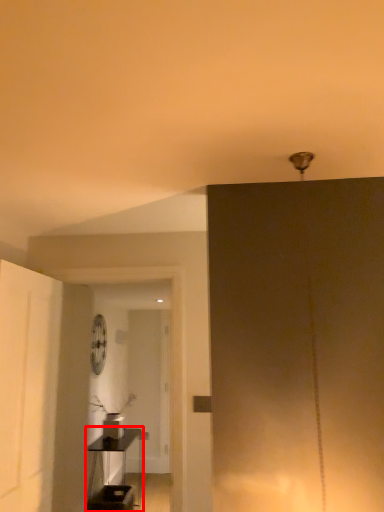
Question: Observing the image, what is the correct spatial positioning of table (annotated by the red box) in reference to fan?

Choices:
 (A) left
 (B) right

Answer: (B)